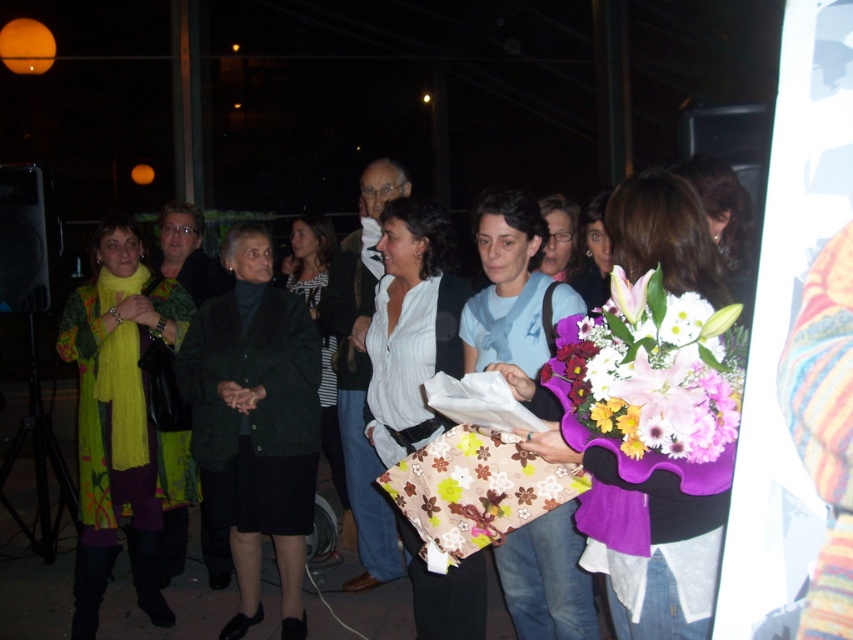
Question: Is white striped shirt at center positioned behind dark green fabric coat at center?

Choices:
 (A) yes
 (B) no

Answer: (B)

Question: Is purple fabric bouquet at center above matte blue shirt at center?

Choices:
 (A) yes
 (B) no

Answer: (B)

Question: Which object is positioned closest to the matte blue shirt at center?

Choices:
 (A) green knitted sweater at left
 (B) dark green fabric coat at center
 (C) matte floral bouquet at center

Answer: (C)

Question: Based on their relative distances, which object is nearer to the matte blue shirt at center?

Choices:
 (A) matte floral bouquet at center
 (B) white striped shirt at center
 (C) dark green fabric coat at center
 (D) dark green wool coat at center

Answer: (B)

Question: Is green knitted sweater at left to the right of matte floral bouquet at center from the viewer's perspective?

Choices:
 (A) no
 (B) yes

Answer: (A)

Question: Which point is farther to the camera?

Choices:
 (A) purple fabric bouquet at center
 (B) green knitted sweater at left
 (C) white striped shirt at center
 (D) dark green fabric coat at center

Answer: (D)